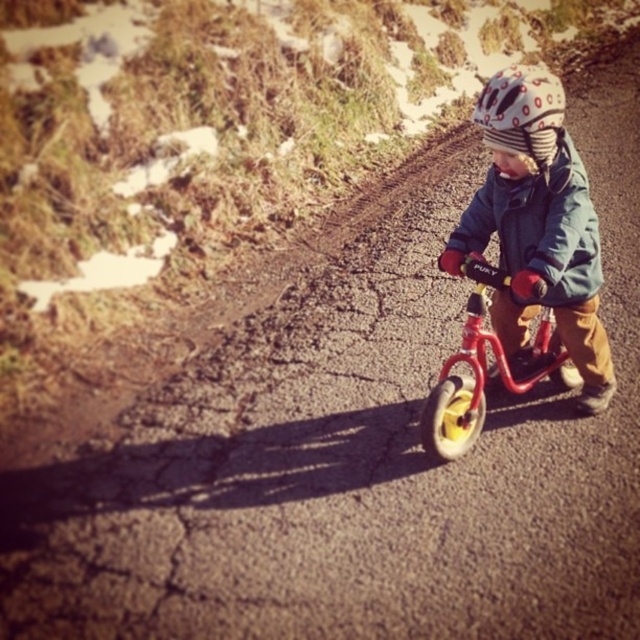
Question: Does metallic red bicycle at center have a greater width compared to white dotted helmet at center?

Choices:
 (A) yes
 (B) no

Answer: (A)

Question: Which object is closer to the camera taking this photo?

Choices:
 (A) blue fleece jacket at center
 (B) matte blue jacket at center
 (C) white dotted helmet at center
 (D) metallic red bicycle at center

Answer: (B)

Question: Which of the following is the farthest from the observer?

Choices:
 (A) (483, 355)
 (B) (504, 100)
 (C) (540, 225)

Answer: (A)

Question: Which point is farther to the camera?

Choices:
 (A) (515, 150)
 (B) (502, 284)
 (C) (584, 294)

Answer: (C)

Question: In this image, where is blue fleece jacket at center located relative to white dotted helmet at center?

Choices:
 (A) left
 (B) right

Answer: (B)

Question: Does blue fleece jacket at center appear on the left side of white dotted helmet at center?

Choices:
 (A) no
 (B) yes

Answer: (A)